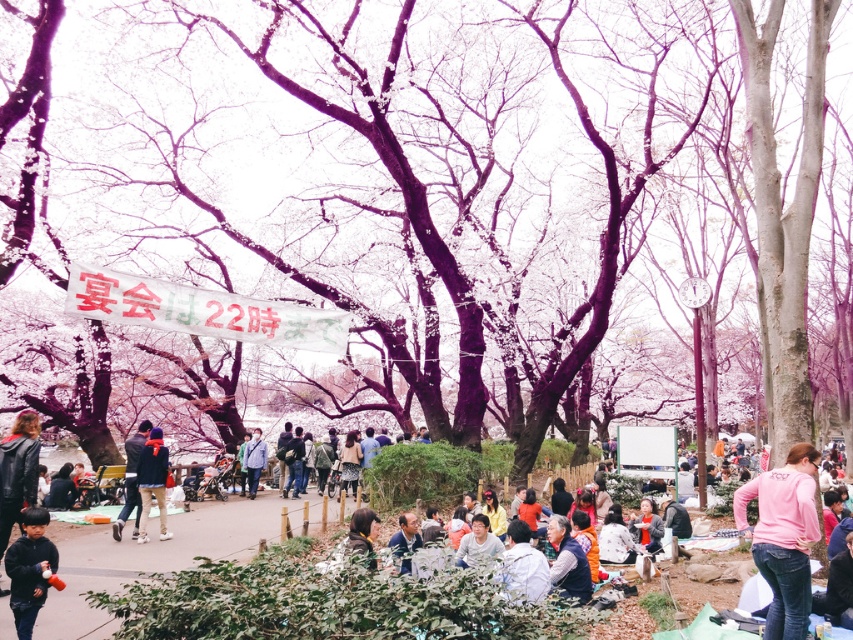
Question: Can you confirm if pink cotton shirt at lower right is wider than light blue fabric jacket at center?

Choices:
 (A) no
 (B) yes

Answer: (A)

Question: Which point is farther to the camera?

Choices:
 (A) (770, 474)
 (B) (12, 598)
 (C) (259, 452)

Answer: (C)

Question: Which object is closer to the camera taking this photo?

Choices:
 (A) pink cotton shirt at lower right
 (B) matte gray jacket at center
 (C) dark blue jacket at center
 (D) light blue fabric jacket at center

Answer: (A)

Question: Estimate the real-world distances between objects in this image. Which object is farther from the black matte jacket at lower left?

Choices:
 (A) matte gray jacket at center
 (B) light blue fabric jacket at center
 (C) pink cotton shirt at lower right

Answer: (B)

Question: Is dark blue jacket at center wider than light blue fabric jacket at center?

Choices:
 (A) yes
 (B) no

Answer: (A)

Question: Can you confirm if black matte jacket at lower left is smaller than matte gray jacket at center?

Choices:
 (A) no
 (B) yes

Answer: (A)